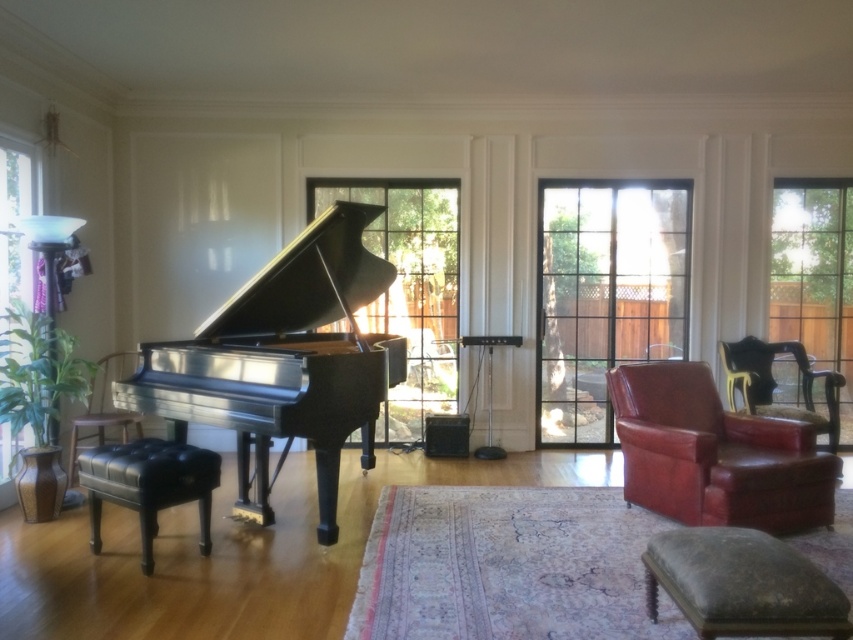
You are planning to place a rectangular coffee table between the matte leather armchair at right and the leather armchair at left. The coffee table is 1.2 meters wide. Can you fit it between them without moving the armchairs?

The matte leather armchair at right might be wider than the leather armchair at left, so the distance between them is uncertain. Without knowing the exact width of the space between the two armchairs, it is not possible to determine if the 1.2 meters wide coffee table will fit.

From the picture: You are standing in the room and need to sit down. You see the matte leather armchair at right and the leather armchair at left. Which one is directly above the other?

The matte leather armchair at right is positioned under the leather armchair at left, so the leather armchair at left is directly above the matte leather armchair at right.